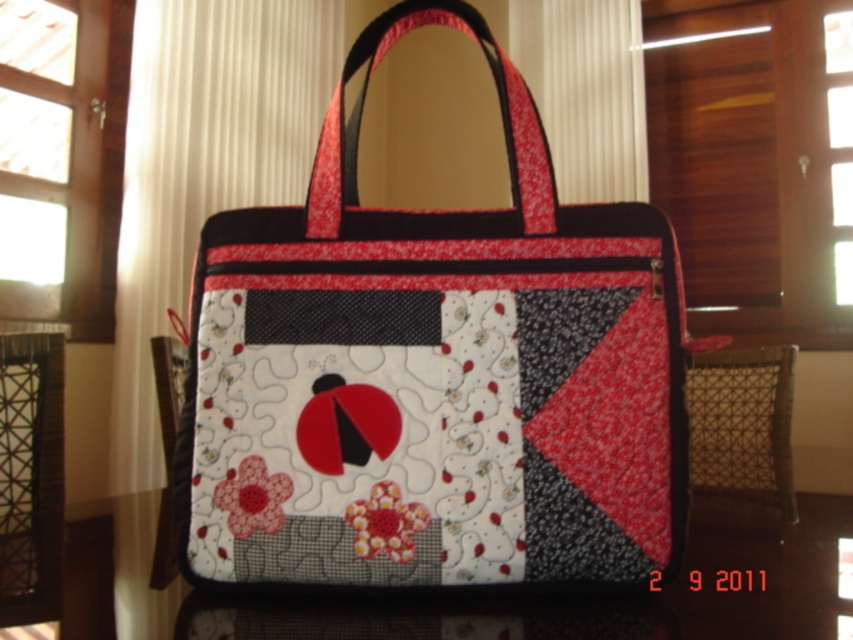
Question: Among these objects, which one is nearest to the camera?

Choices:
 (A) quilted fabric at center
 (B) quilted fabric bag at center

Answer: (B)

Question: Among these objects, which one is nearest to the camera?

Choices:
 (A) quilted fabric at center
 (B) quilted fabric bag at center

Answer: (B)

Question: Is quilted fabric bag at center smaller than quilted fabric at center?

Choices:
 (A) no
 (B) yes

Answer: (A)

Question: Observing the image, what is the correct spatial positioning of quilted fabric bag at center in reference to quilted fabric at center?

Choices:
 (A) above
 (B) below

Answer: (A)

Question: In this image, where is quilted fabric bag at center located relative to quilted fabric at center?

Choices:
 (A) above
 (B) below

Answer: (A)

Question: Among these points, which one is farthest from the camera?

Choices:
 (A) (387, 525)
 (B) (315, 282)

Answer: (B)